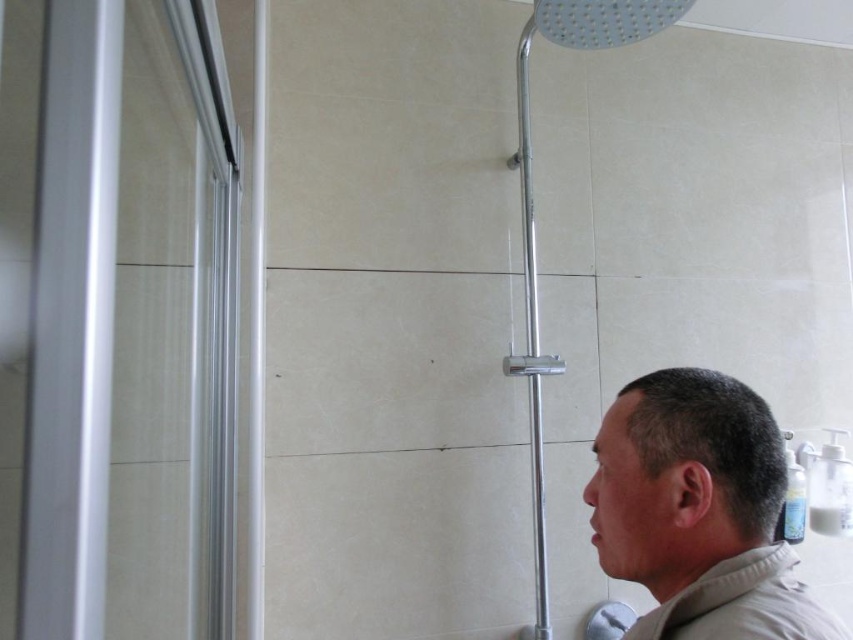
Question: Among these objects, which one is nearest to the camera?

Choices:
 (A) transparent glass door at left
 (B) gray matte head at lower right
 (C) transparent glass shower door at left
 (D) beige cotton robe at lower right

Answer: (A)

Question: Among these objects, which one is nearest to the camera?

Choices:
 (A) gray matte head at lower right
 (B) beige cotton robe at lower right

Answer: (B)

Question: In this image, where is gray matte head at lower right located relative to transparent glass shower door at left?

Choices:
 (A) right
 (B) left

Answer: (A)

Question: Is transparent glass door at left bigger than transparent glass shower door at left?

Choices:
 (A) yes
 (B) no

Answer: (A)

Question: Which of the following is the closest to the observer?

Choices:
 (A) transparent glass shower door at left
 (B) gray matte head at lower right
 (C) beige cotton robe at lower right

Answer: (C)

Question: Does transparent glass door at left have a smaller size compared to gray matte head at lower right?

Choices:
 (A) yes
 (B) no

Answer: (B)